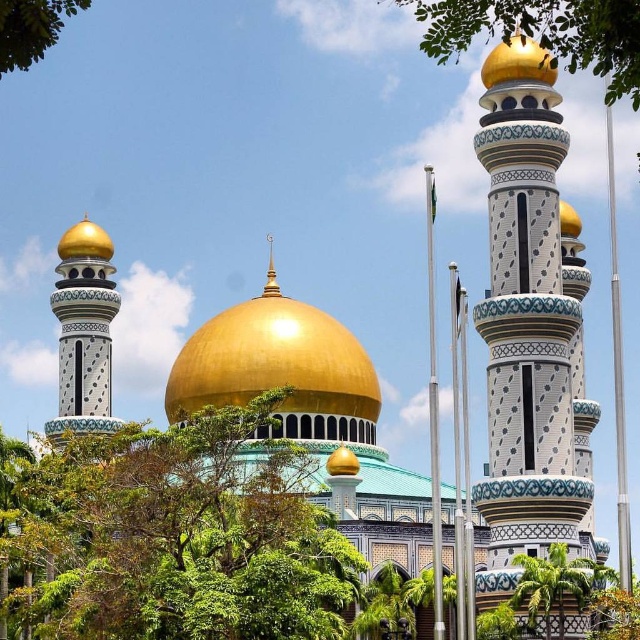
Question: Does white mosaic tower at right have a smaller size compared to green leafy tree at lower right?

Choices:
 (A) no
 (B) yes

Answer: (A)

Question: Which point appears closest to the camera in this image?

Choices:
 (A) [435, 51]
 (B) [545, 637]

Answer: (A)

Question: Which object appears farthest from the camera in this image?

Choices:
 (A) white mosaic tower at right
 (B) green leafy tree at upper center

Answer: (A)

Question: Can you confirm if green leafy tree at upper center is smaller than green leafy tree at lower right?

Choices:
 (A) yes
 (B) no

Answer: (B)

Question: Which point is farther from the camera taking this photo?

Choices:
 (A) (518, 588)
 (B) (13, 38)
 (C) (330, 374)

Answer: (C)

Question: Is white mosaic tower at right positioned in front of green leafy tree at upper left?

Choices:
 (A) yes
 (B) no

Answer: (B)